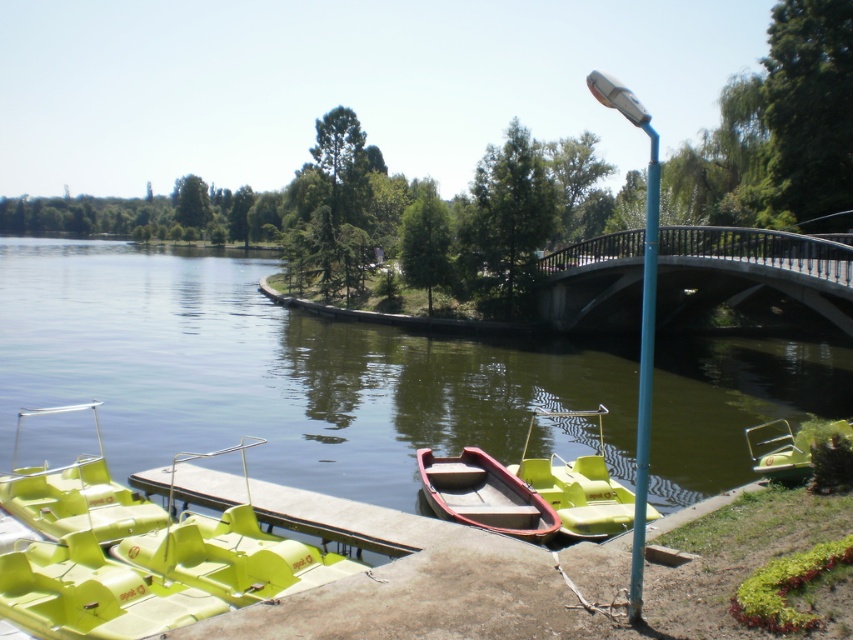
Question: Considering the relative positions of gray concrete bridge at center and wooden canoe at center in the image provided, where is gray concrete bridge at center located with respect to wooden canoe at center?

Choices:
 (A) left
 (B) right

Answer: (B)

Question: Does wooden canoe at center have a smaller size compared to matte green paddle boat at center?

Choices:
 (A) yes
 (B) no

Answer: (A)

Question: Among these objects, which one is farthest from the camera?

Choices:
 (A) matte green paddle boat at center
 (B) green plastic boat at lower right
 (C) wooden canoe at center

Answer: (B)

Question: Does wooden canoe at center appear on the left side of blue metallic pole at right?

Choices:
 (A) yes
 (B) no

Answer: (A)

Question: Which point is farther to the camera?

Choices:
 (A) green plastic boats at lower left
 (B) matte green paddle boat at center
 (C) matte green plastic paddle boat at lower left
 (D) gray concrete bridge at center

Answer: (D)

Question: Among these objects, which one is farthest from the camera?

Choices:
 (A) matte green paddle boat at center
 (B) green plastic boats at lower left
 (C) blue metallic pole at right

Answer: (B)